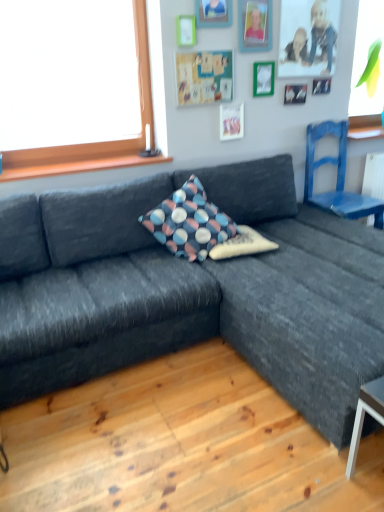
Question: Is green matte picture frame at upper center, the 6th picture frame positioned from the right, situated inside wooden picture frame at upper center, the second picture frame when ordered from left to right, or outside?

Choices:
 (A) inside
 (B) outside

Answer: (B)

Question: Does point (192, 37) appear closer or farther from the camera than point (213, 17)?

Choices:
 (A) closer
 (B) farther

Answer: (A)

Question: Based on their relative distances, which object is nearer to the blue painted wood chair at right?

Choices:
 (A) green matte picture frame at upper center, arranged as the 2th picture frame when viewed from the right
 (B) green matte picture frame at upper center, which is counted as the 1th picture frame, starting from the left
 (C) wooden picture frame at upper center, positioned as the first picture frame in right-to-left order
 (D) white paper at upper center, which is the 3th picture frame from left to right
 (E) textured fabric pillow at center, the 2th pillow positioned from the top

Answer: (C)

Question: Estimate the real-world distances between objects in this image. Which object is farther from the textured fabric pillow at center, which appears as the first pillow when ordered from the bottom?

Choices:
 (A) blue painted wood chair at right
 (B) polka dot fabric pillow at center, placed as the first pillow when sorted from top to bottom
 (C) matte green bulletin board at upper center
 (D) green matte picture frame at upper center, arranged as the 2th picture frame when viewed from the right
 (E) white paper at upper center, which appears as the fourth picture frame when viewed from the right

Answer: (D)